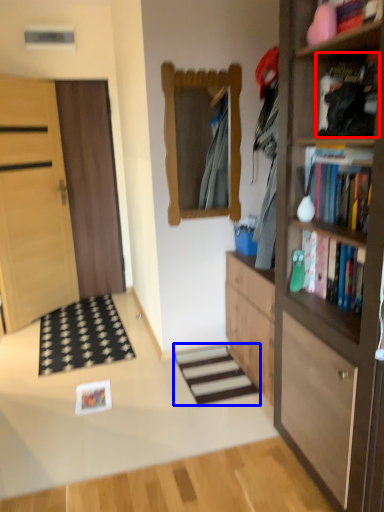
Question: Which of the following is the closest to the observer, book (highlighted by a red box) or stairwell (highlighted by a blue box)?

Choices:
 (A) book
 (B) stairwell

Answer: (A)